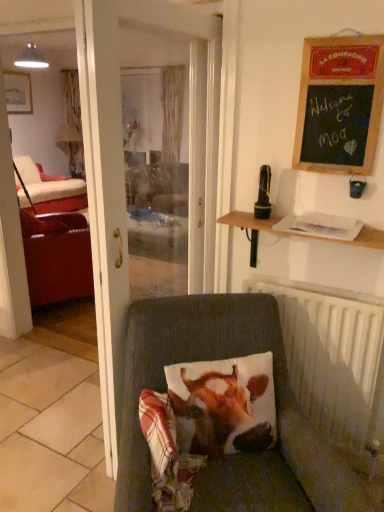
Question: Is black rubberized phone at upper right at the right side of printed fabric cow at center?

Choices:
 (A) no
 (B) yes

Answer: (B)

Question: Does black rubberized phone at upper right have a larger size compared to printed fabric cow at center?

Choices:
 (A) yes
 (B) no

Answer: (B)

Question: Considering the relative sizes of black rubberized phone at upper right and printed fabric cow at center in the image provided, is black rubberized phone at upper right taller than printed fabric cow at center?

Choices:
 (A) no
 (B) yes

Answer: (A)

Question: From a real-world perspective, is black rubberized phone at upper right physically below printed fabric cow at center?

Choices:
 (A) yes
 (B) no

Answer: (B)

Question: From a real-world perspective, is black rubberized phone at upper right over printed fabric cow at center?

Choices:
 (A) yes
 (B) no

Answer: (A)

Question: Does black rubberized phone at upper right turn towards printed fabric cow at center?

Choices:
 (A) yes
 (B) no

Answer: (B)

Question: From a real-world perspective, is velvet cushion at lower center below black rubberized phone at upper right?

Choices:
 (A) no
 (B) yes

Answer: (B)

Question: Can you confirm if velvet cushion at lower center is bigger than black rubberized phone at upper right?

Choices:
 (A) no
 (B) yes

Answer: (B)

Question: Is velvet cushion at lower center not close to black rubberized phone at upper right?

Choices:
 (A) no
 (B) yes

Answer: (A)

Question: Can you confirm if velvet cushion at lower center is wider than black rubberized phone at upper right?

Choices:
 (A) yes
 (B) no

Answer: (A)

Question: Can we say velvet cushion at lower center lies outside black rubberized phone at upper right?

Choices:
 (A) no
 (B) yes

Answer: (B)

Question: Is velvet cushion at lower center to the right of black rubberized phone at upper right from the viewer's perspective?

Choices:
 (A) no
 (B) yes

Answer: (A)

Question: Does black chalkboard at upper right have a lesser width compared to white metallic radiator at lower right?

Choices:
 (A) yes
 (B) no

Answer: (A)